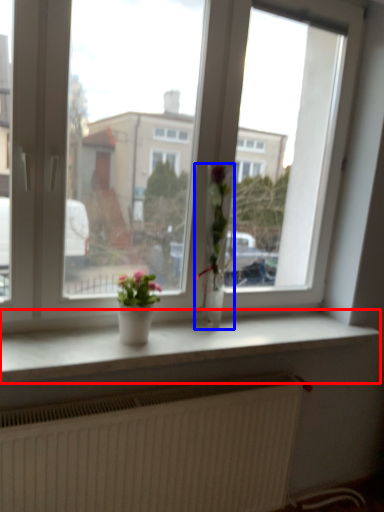
Question: Which object is further to the camera taking this photo, window sill (highlighted by a red box) or houseplant (highlighted by a blue box)?

Choices:
 (A) window sill
 (B) houseplant

Answer: (B)